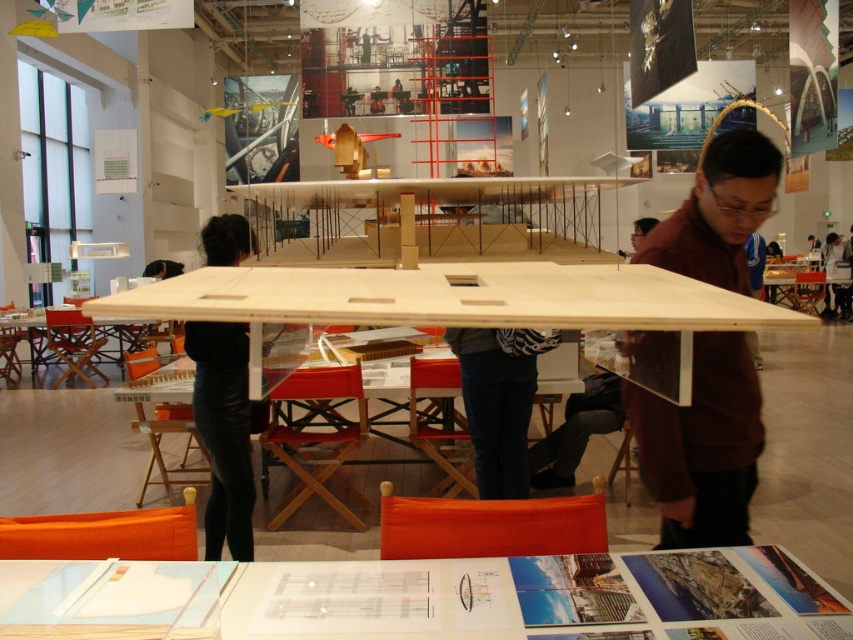
Does wooden table at center come behind black leather pants at center?

No, wooden table at center is closer to the viewer.

Does wooden table at center have a lesser width compared to black leather pants at center?

No.

You are a GUI agent. You are given a task and a screenshot of the screen. Output one action in this format:
    pyautogui.click(x=<x>, y=<y>)
    Task: Click on the wooden table at center
    
    Given the screenshot: What is the action you would take?
    pyautogui.click(x=451, y=298)

You are a GUI agent. You are given a task and a screenshot of the screen. Output one action in this format:
    pyautogui.click(x=<x>, y=<y>)
    Task: Click on the wooden table at center
    The height and width of the screenshot is (640, 853).
    Given the screenshot: What is the action you would take?
    pyautogui.click(x=451, y=298)

Between brown sweater at upper right and white shirt at center, which one appears on the right side from the viewer's perspective?

white shirt at center is more to the right.

How far apart are brown sweater at upper right and white shirt at center?

The distance of brown sweater at upper right from white shirt at center is 13.56 meters.

Is point (726, 534) farther from viewer compared to point (828, 252)?

That is False.

Locate an element on the screen. The image size is (853, 640). brown sweater at upper right is located at coordinates (701, 445).

Who is taller, white paper at center or black leather pants at center?

With more height is black leather pants at center.

How distant is white paper at center from black leather pants at center?

white paper at center is 1.33 meters from black leather pants at center.

The height and width of the screenshot is (640, 853). Find the location of `white paper at center`. white paper at center is located at coordinates (428, 596).